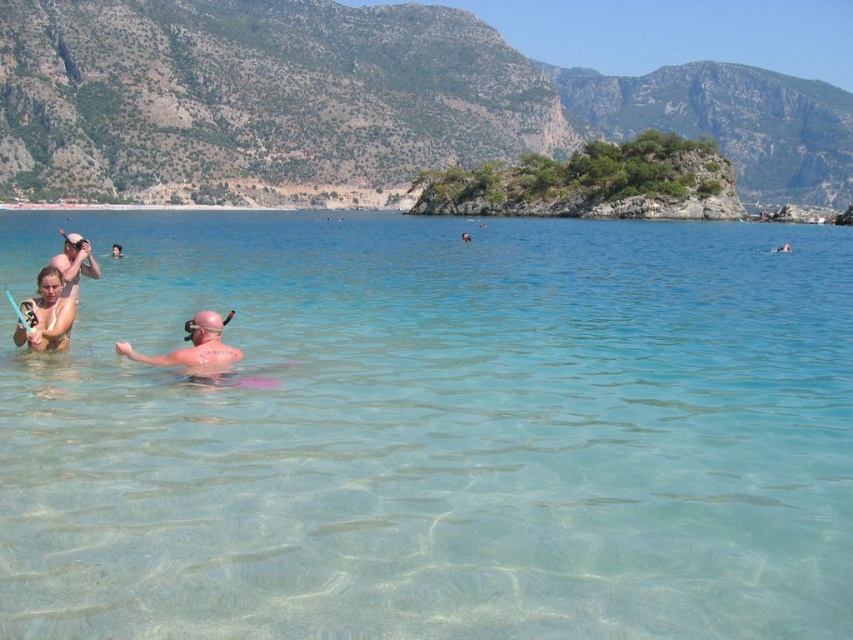
You are a photographer trying to capture the matte black bikini at left and the matte white swim cap at upper left in a single shot. Since you want to ensure both items are clearly visible, which object should you focus on first to account for their sizes?

The matte black bikini at left is smaller in width than the matte white swim cap at upper left, so you should focus on the matte black bikini at left first to ensure its details are captured clearly.

Looking at this image, you are a lifeguard standing at the edge of the water. You need to reach either the matte black bikini at left or the matte white swim cap at upper left to assist someone. Given that you can move 1 meter per second, which object will you reach first if you start moving towards them at the same time?

The distance between the matte black bikini at left and the matte white swim cap at upper left is 1.28 meters. Since both are being approached simultaneously and the distance is fixed, you would reach them at the same time if moving at the same speed. However, since the question implies choosing one, perhaps there is an error in the setup. Alternatively, if considering the shortest path, but the description doesn not specify direction. The answer might need clarification.